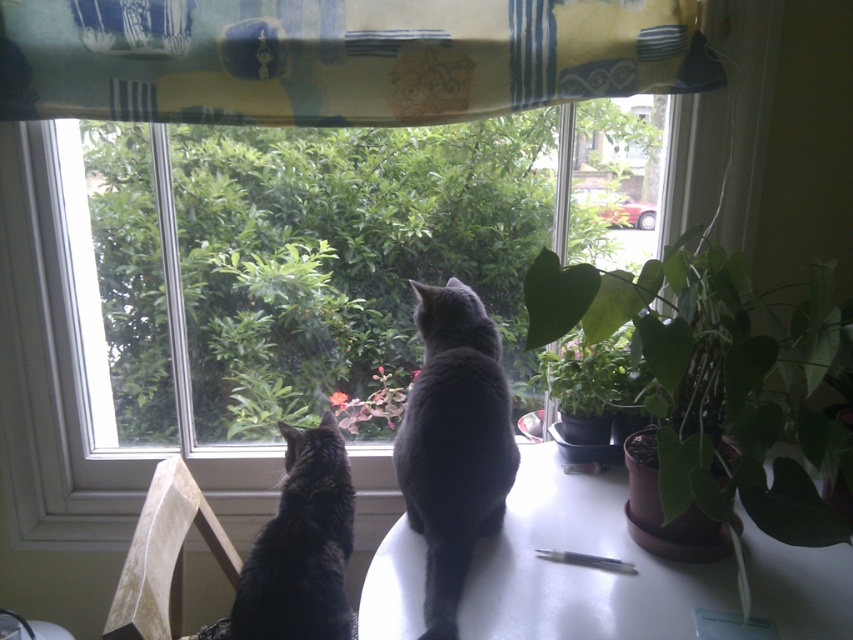
Which is more to the left, matte gray cat at center or black fur cat at center?

black fur cat at center is more to the left.

Which is above, matte gray cat at center or black fur cat at center?

matte gray cat at center is higher up.

Measure the distance between matte gray cat at center and camera.

They are 38.09 inches apart.

What are the coordinates of `matte gray cat at center` in the screenshot? It's located at (453, 444).

Which is behind, point (339, 0) or point (361, 628)?

The point (339, 0) is behind.

Who is positioned more to the left, yellow fabric at upper center or white glossy table at center?

Positioned to the left is yellow fabric at upper center.

The height and width of the screenshot is (640, 853). Identify the location of yellow fabric at upper center. (339, 58).

Who is higher up, green matte plant at right or matte gray cat at center?

green matte plant at right is higher up.

Is green matte plant at right wider than matte gray cat at center?

Yes.

Which is behind, point (599, 321) or point (450, 572)?

The point (599, 321) is more distant.

This screenshot has height=640, width=853. Find the location of `green matte plant at right`. green matte plant at right is located at coordinates (718, 380).